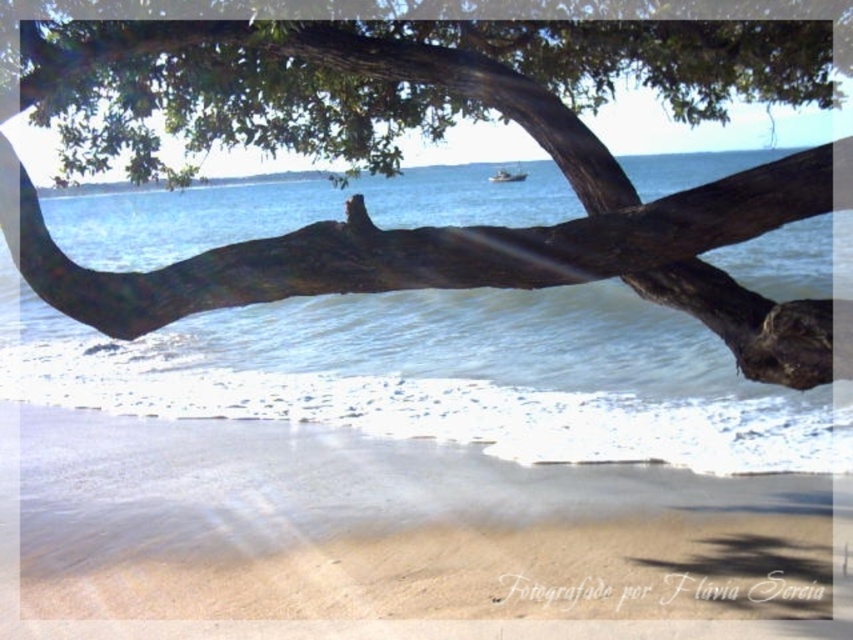
Which is above, smooth brown branch at upper center or sandy beach at lower center?

smooth brown branch at upper center is above.

Is smooth brown branch at upper center taller than sandy beach at lower center?

Yes.

Describe the element at coordinates (434, 132) in the screenshot. I see `smooth brown branch at upper center` at that location.

Where is `smooth brown branch at upper center`? This screenshot has width=853, height=640. smooth brown branch at upper center is located at coordinates (434, 132).

Based on the photo, can you confirm if smooth brown branch at upper center is shorter than metallic silver boat at center?

In fact, smooth brown branch at upper center may be taller than metallic silver boat at center.

Is smooth brown branch at upper center in front of metallic silver boat at center?

Yes, smooth brown branch at upper center is in front of metallic silver boat at center.

Is point (761, 168) less distant than point (500, 168)?

Yes, it is.

Where is `smooth brown branch at upper center`? The width and height of the screenshot is (853, 640). smooth brown branch at upper center is located at coordinates (434, 132).

Is point (784, 531) positioned behind point (492, 177)?

No, (784, 531) is closer to viewer.

Describe the element at coordinates (393, 529) in the screenshot. The width and height of the screenshot is (853, 640). I see `sandy beach at lower center` at that location.

At what (x,y) coordinates should I click in order to perform the action: click on sandy beach at lower center. Please return your answer as a coordinate pair (x, y). This screenshot has width=853, height=640. Looking at the image, I should click on (393, 529).